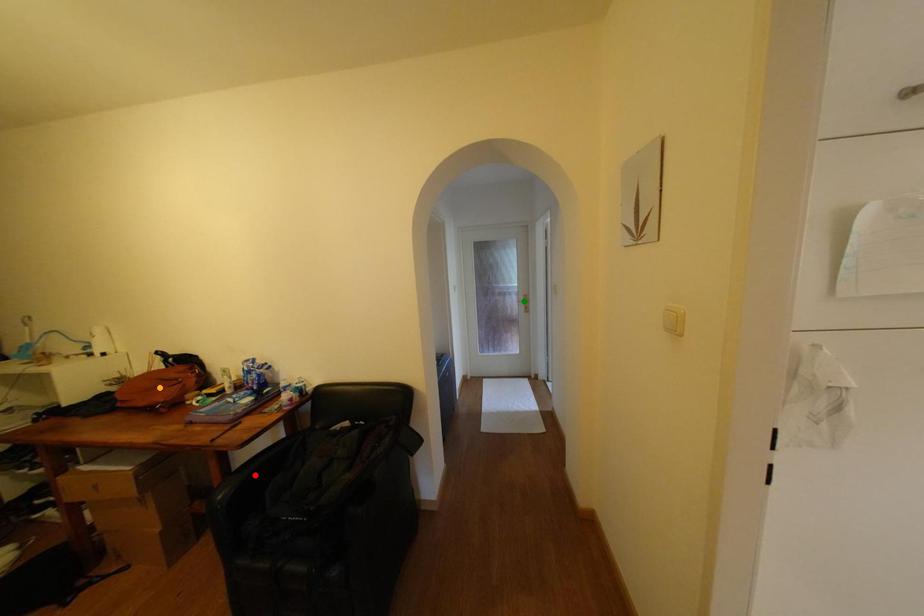
Order these from nearest to farthest:
1. orange point
2. green point
3. red point

1. red point
2. orange point
3. green point